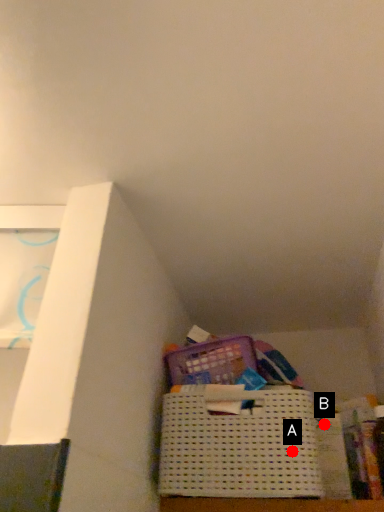
Question: Two points are circled on the image, labeled by A and B beside each circle. Among these points, which one is farthest from the camera?

Choices:
 (A) A is further
 (B) B is further

Answer: (B)